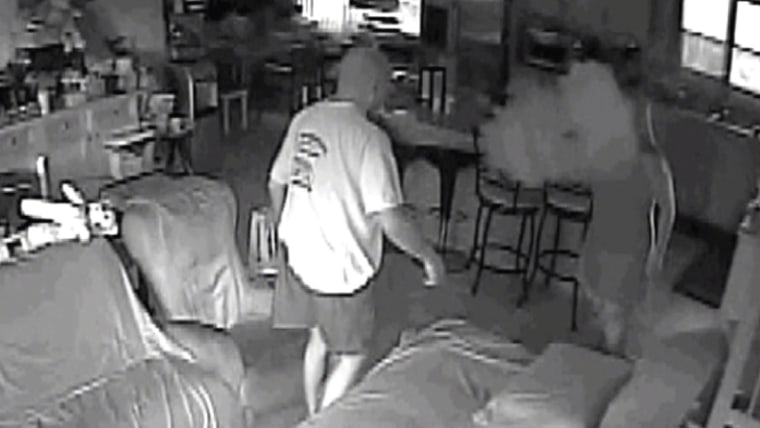
At what (x,y) coordinates should I click in order to perform the action: click on stools. Please return your answer as a coordinate pair (x, y). This screenshot has height=428, width=760. Looking at the image, I should click on (501, 224), (568, 224), (437, 166).